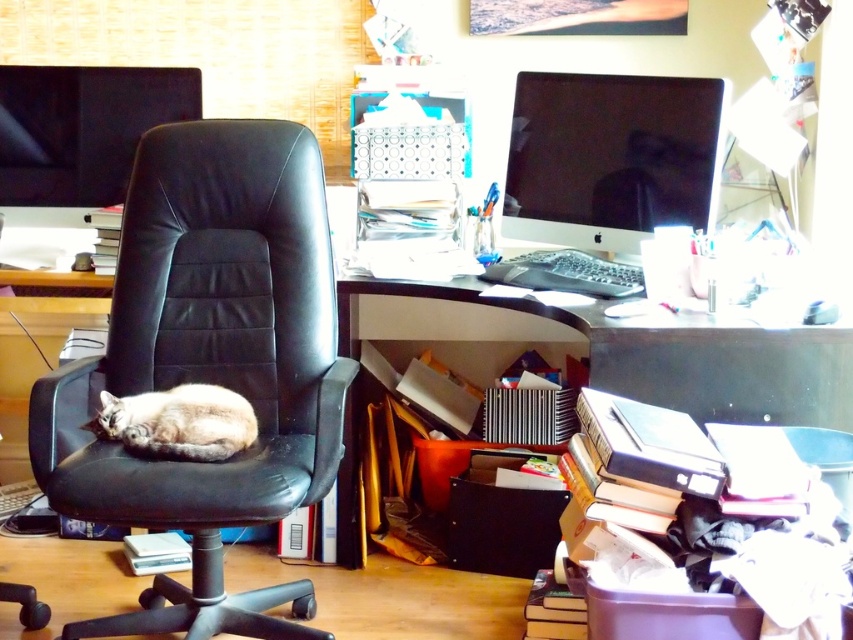
Question: Is black leather swivel chair at left wider than wooden desk at lower right?

Choices:
 (A) no
 (B) yes

Answer: (A)

Question: Which object is positioned farthest from the fuzzy beige cat at center?

Choices:
 (A) black leather swivel chair at left
 (B) wooden desk at lower right
 (C) black glossy monitor at upper center

Answer: (C)

Question: Can you confirm if black glossy monitor at upper center is positioned above fuzzy beige cat at center?

Choices:
 (A) no
 (B) yes

Answer: (B)

Question: Estimate the real-world distances between objects in this image. Which object is closer to the black leather swivel chair at left?

Choices:
 (A) wooden desk at lower right
 (B) black glossy monitor at upper center
 (C) fuzzy beige cat at center

Answer: (C)

Question: Estimate the real-world distances between objects in this image. Which object is farther from the fuzzy beige cat at center?

Choices:
 (A) black leather swivel chair at left
 (B) black glossy monitor at upper center

Answer: (B)

Question: Can you confirm if black glossy monitor at upper center is positioned to the right of fuzzy beige cat at center?

Choices:
 (A) yes
 (B) no

Answer: (A)